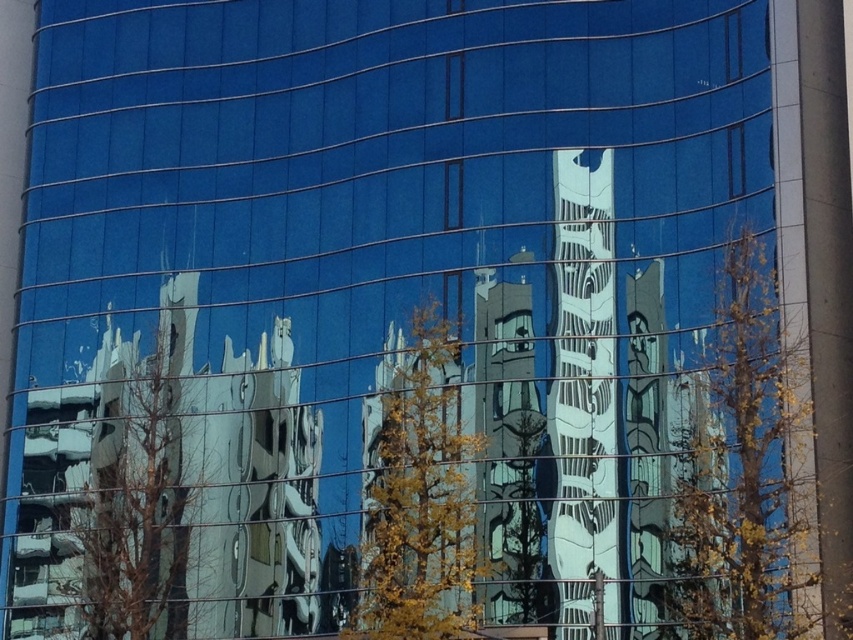
You are standing in front of the modern building with the glass facade. There is a yellow leafy tree at right in the foreground. If you look at the point with coordinates (746, 472), what object will you see there?

The point at coordinates (746, 472) corresponds to the yellow leafy tree at right.